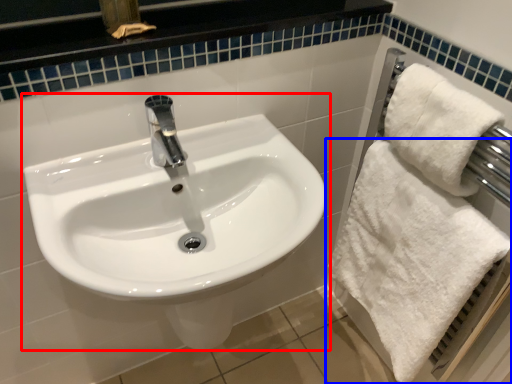
Question: Among these objects, which one is nearest to the camera, sink (highlighted by a red box) or towel (highlighted by a blue box)?

Choices:
 (A) sink
 (B) towel

Answer: (A)